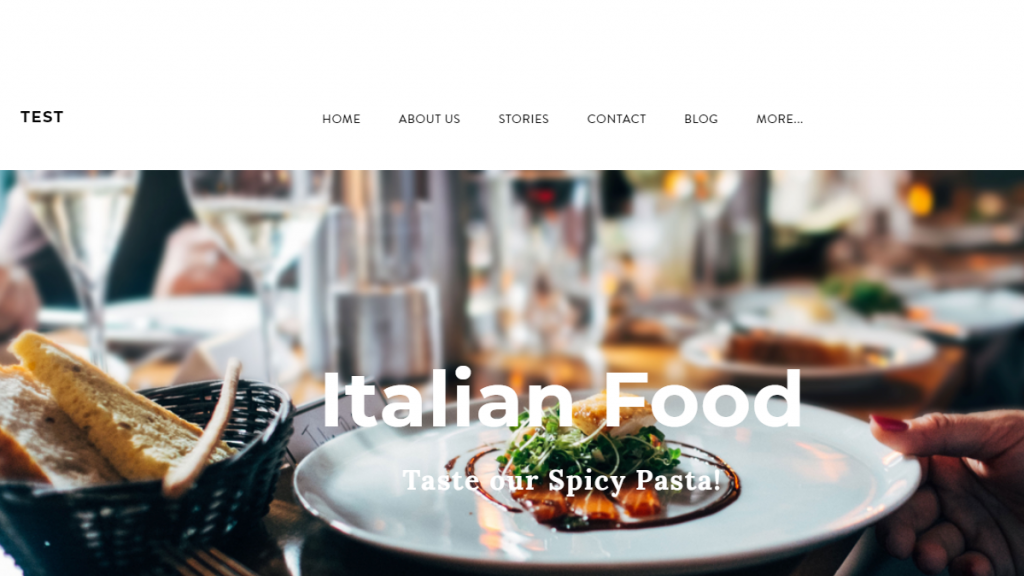
Identify the location of wicker basket. (214, 510).